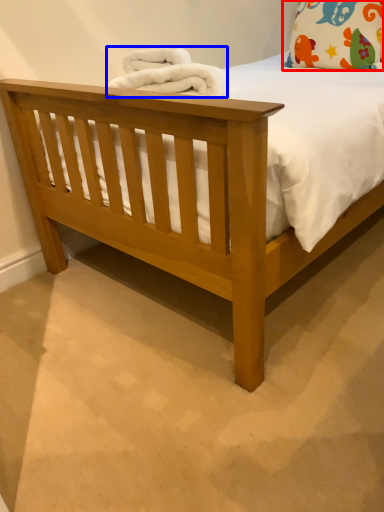
Question: Which of the following is the farthest to the observer, pillow (highlighted by a red box) or material (highlighted by a blue box)?

Choices:
 (A) pillow
 (B) material

Answer: (A)